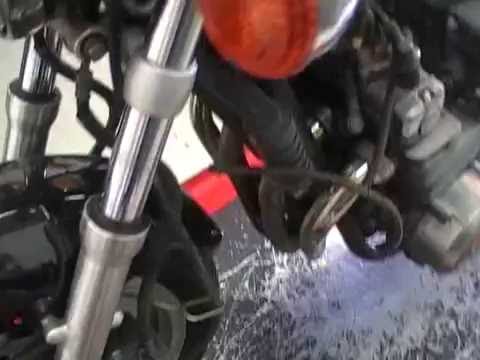
Locate an element on the screen. black cables is located at coordinates (376, 202), (272, 168), (85, 86), (107, 133), (109, 121), (97, 86), (61, 61).